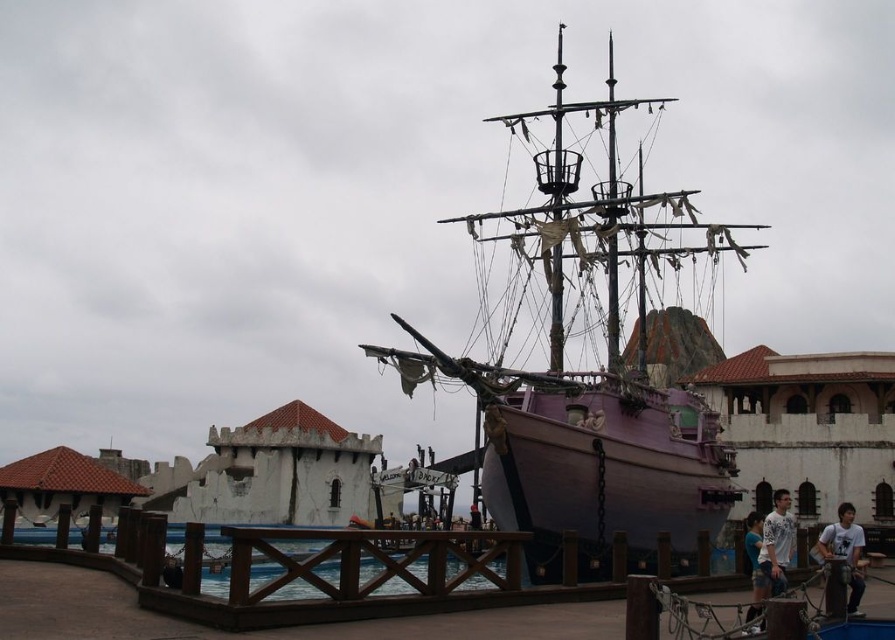
Does point (766, 572) come behind point (844, 518)?

No.

Where is `white cotton shirt at lower right`? white cotton shirt at lower right is located at coordinates (773, 552).

Measure the distance from brown wooden dock at center to white cotton shirt at lower right.

22.07 meters

Is brown wooden dock at center below white cotton shirt at lower right?

Indeed, brown wooden dock at center is positioned under white cotton shirt at lower right.

At what (x,y) coordinates should I click in order to perform the action: click on brown wooden dock at center. Please return your answer as a coordinate pair (x, y). The height and width of the screenshot is (640, 895). Looking at the image, I should click on (300, 600).

Between purple matte ship at center and brown wooden dock at center, which one has more height?

Standing taller between the two is purple matte ship at center.

I want to click on purple matte ship at center, so 589,388.

The image size is (895, 640). In order to click on purple matte ship at center in this screenshot , I will do `click(589, 388)`.